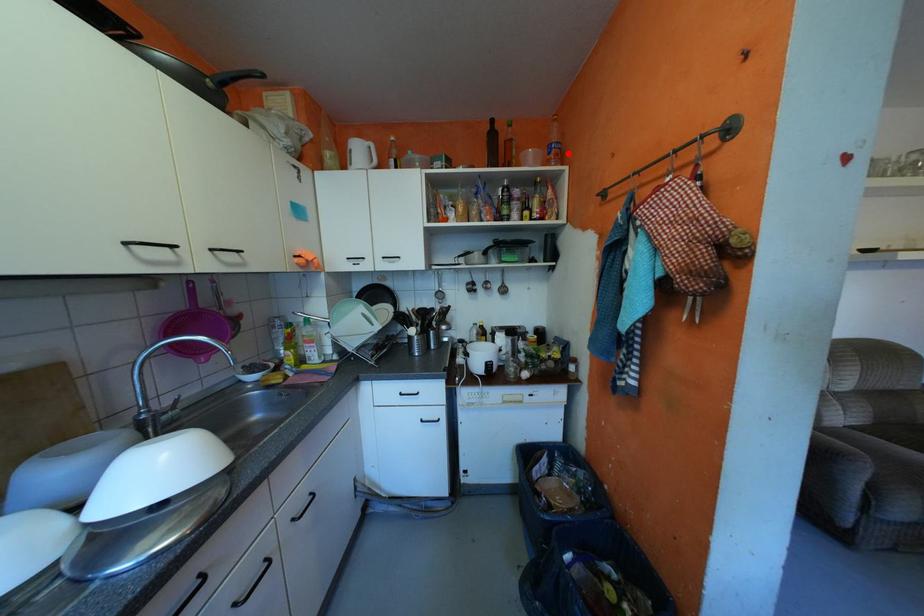
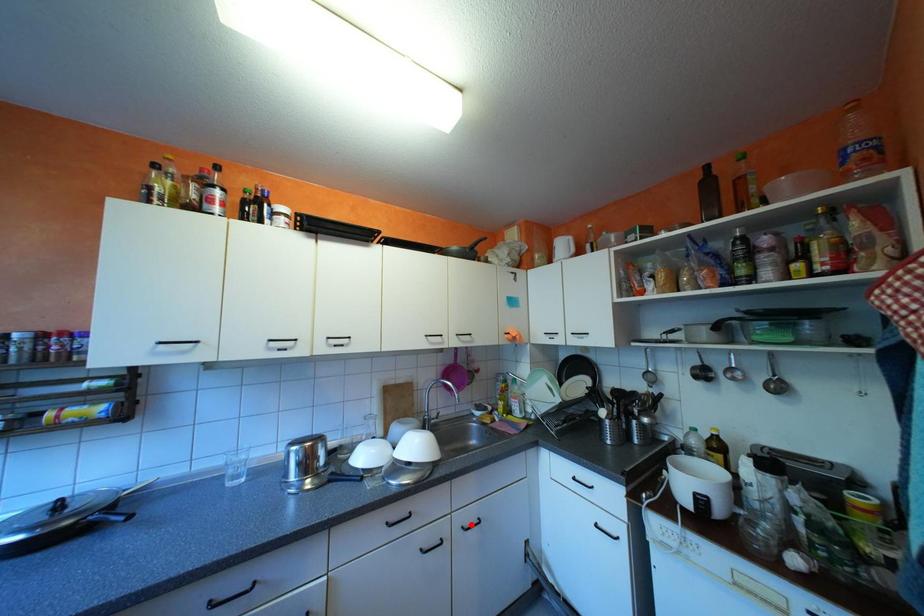
I am providing you with two images of the same scene from different viewpoints. A red point is marked on the first image and another point is marked on the second image. Is the marked point in image1 the same physical position as the marked point in image2?

No